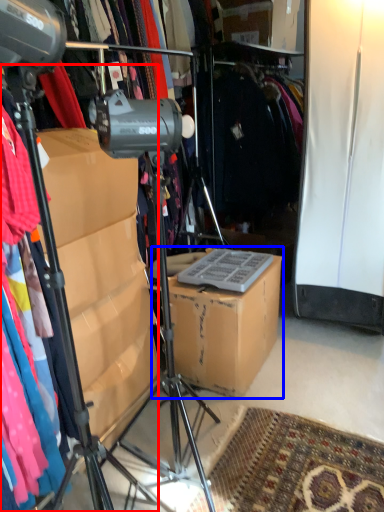
Question: Among these objects, which one is farthest to the camera, tripod (highlighted by a red box) or cardboard box (highlighted by a blue box)?

Choices:
 (A) tripod
 (B) cardboard box

Answer: (B)